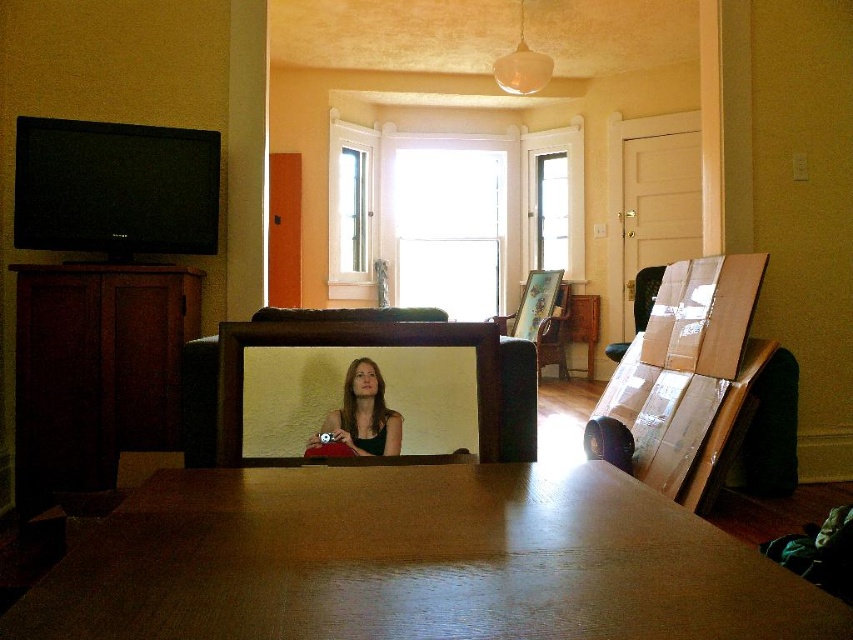
You are holding a camera and want to take a photo of the wooden table at center. If you are standing 16.09 inches away from it, is that close enough to capture the entire table in the frame?

The wooden table at center and camera are 16.09 inches apart from each other. Whether this distance is close enough depends on the camera lens and sensor size. However, since the question doesn not provide camera specifications, we can only confirm the distance is 16.09 inches.